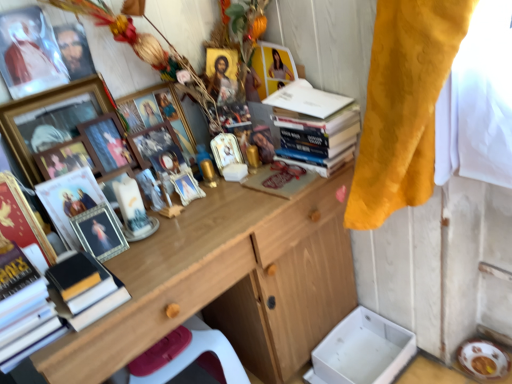
Locate an element on the screen. The image size is (512, 384). free space in front of metallic gold picture frame at center, the first picture frame positioned from the right is located at coordinates (229, 195).